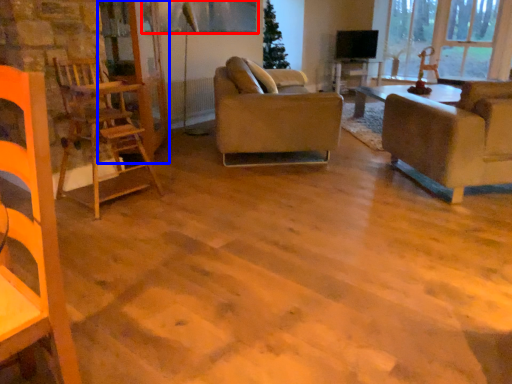
Question: Which object is closer to the camera taking this photo, window screen (highlighted by a red box) or glass door (highlighted by a blue box)?

Choices:
 (A) window screen
 (B) glass door

Answer: (B)